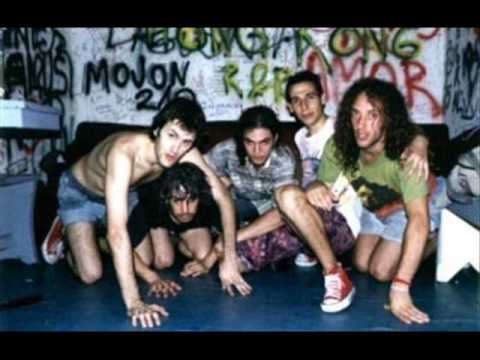
You are a GUI agent. You are given a task and a screenshot of the screen. Output one action in this format:
    pyautogui.click(x=<x>, y=<y>)
    Task: Click on the black sofa
    
    Given the screenshot: What is the action you would take?
    pyautogui.click(x=220, y=135)